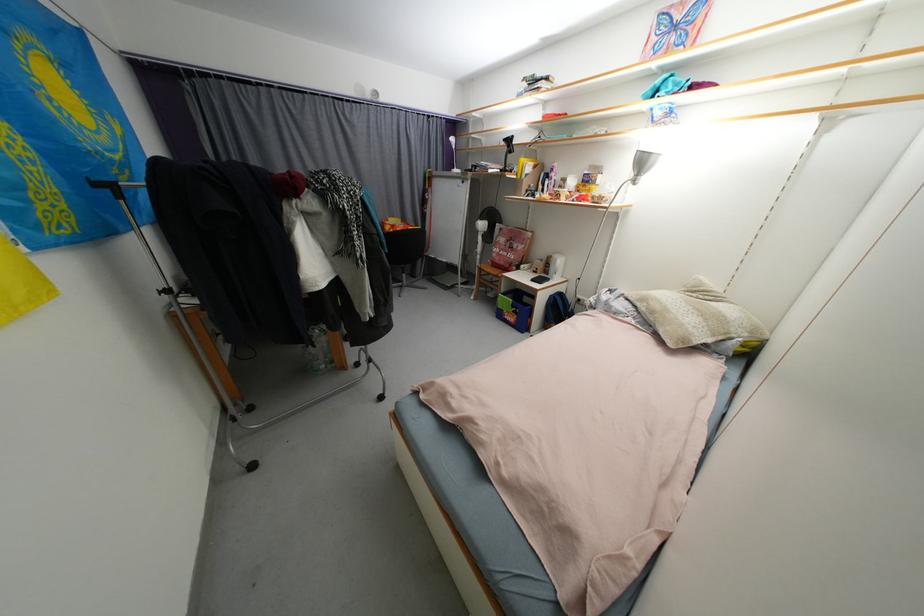
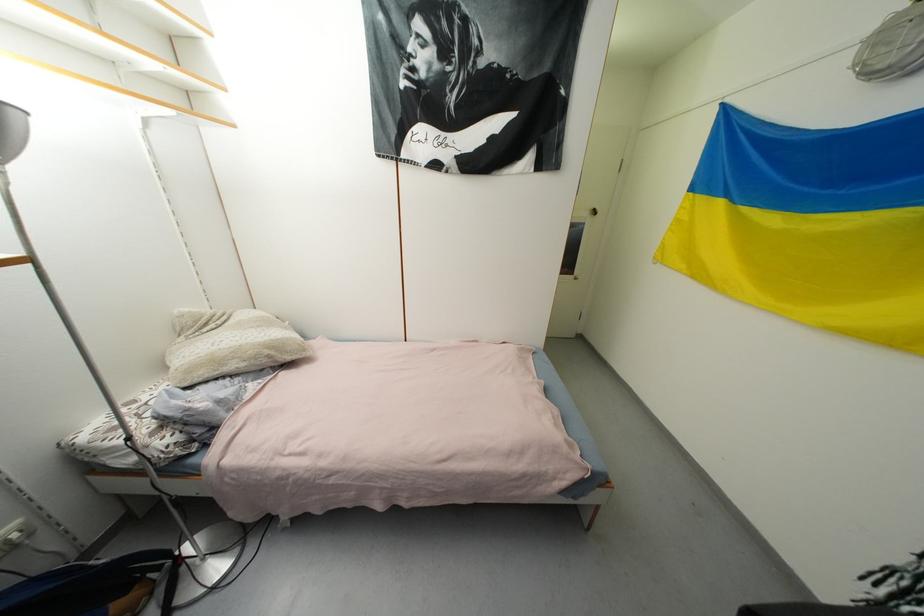
In the second image, find the point that corresponds to point 658,314 in the first image.

(261, 359)